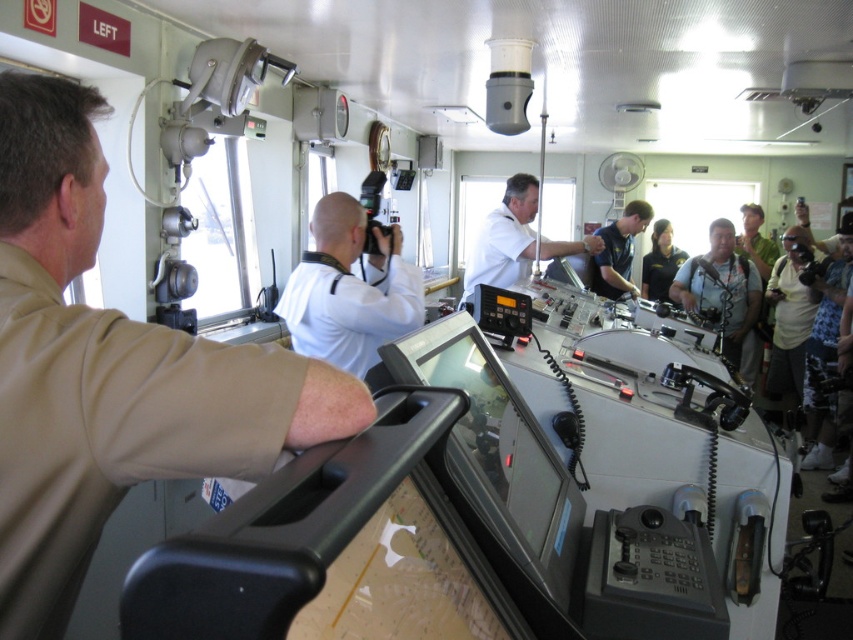
Question: Which of these objects is positioned closest to the matte khaki uniform at left?

Choices:
 (A) matte black camera at right
 (B) white matte camera at center

Answer: (B)

Question: Does white matte camera at center appear on the right side of matte black camera at right?

Choices:
 (A) no
 (B) yes

Answer: (A)

Question: Among these points, which one is nearest to the camera?

Choices:
 (A) (651, 216)
 (B) (497, 275)

Answer: (B)

Question: Is white matte camera at center bigger than matte black camera at right?

Choices:
 (A) yes
 (B) no

Answer: (B)

Question: Among these objects, which one is farthest from the camera?

Choices:
 (A) dark blue uniform at center
 (B) matte khaki uniform at left

Answer: (A)

Question: Can you confirm if matte black camera at right is smaller than dark blue uniform at center?

Choices:
 (A) no
 (B) yes

Answer: (A)